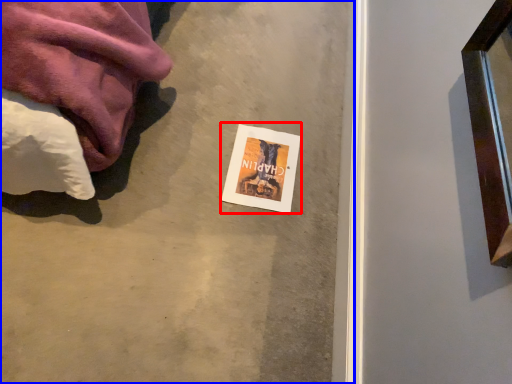
Question: Which object appears farthest to the camera in this image, flyer (highlighted by a red box) or concrete (highlighted by a blue box)?

Choices:
 (A) flyer
 (B) concrete

Answer: (A)